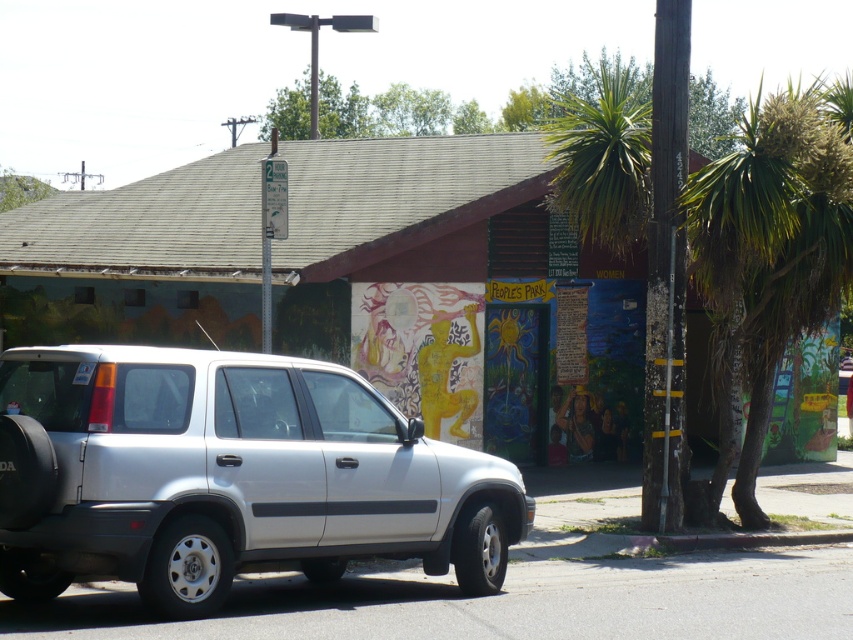
Question: Among these objects, which one is nearest to the camera?

Choices:
 (A) wooden pole at right
 (B) silver metallic suv at center

Answer: (B)

Question: Which point is farther from the camera taking this photo?

Choices:
 (A) (677, 164)
 (B) (381, 532)

Answer: (A)

Question: Can you confirm if silver metallic suv at center is thinner than wooden pole at right?

Choices:
 (A) yes
 (B) no

Answer: (B)

Question: Is silver metallic suv at center further to camera compared to wooden pole at right?

Choices:
 (A) no
 (B) yes

Answer: (A)

Question: Can you confirm if silver metallic suv at center is bigger than wooden pole at right?

Choices:
 (A) no
 (B) yes

Answer: (B)

Question: Which point is closer to the camera?

Choices:
 (A) wooden pole at right
 (B) silver metallic suv at center

Answer: (B)